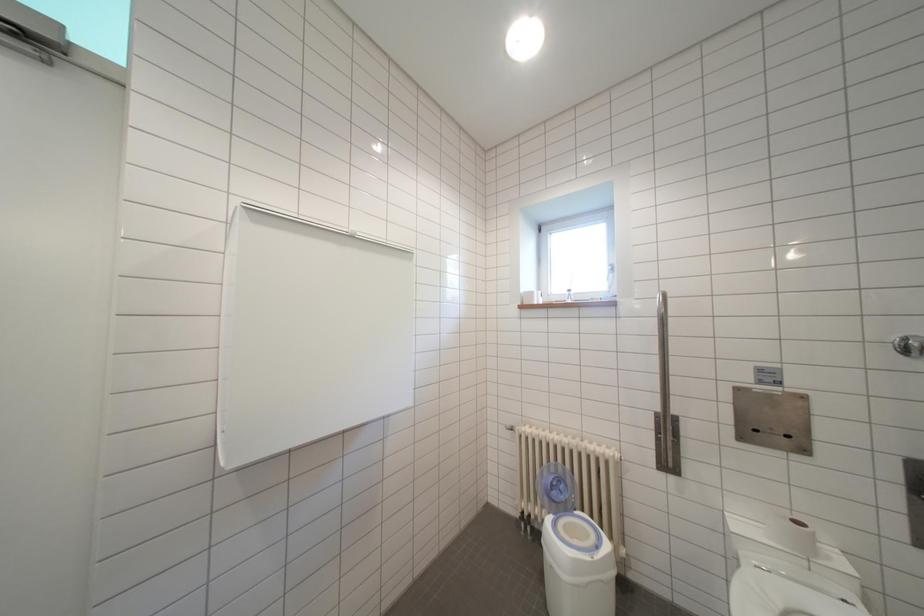
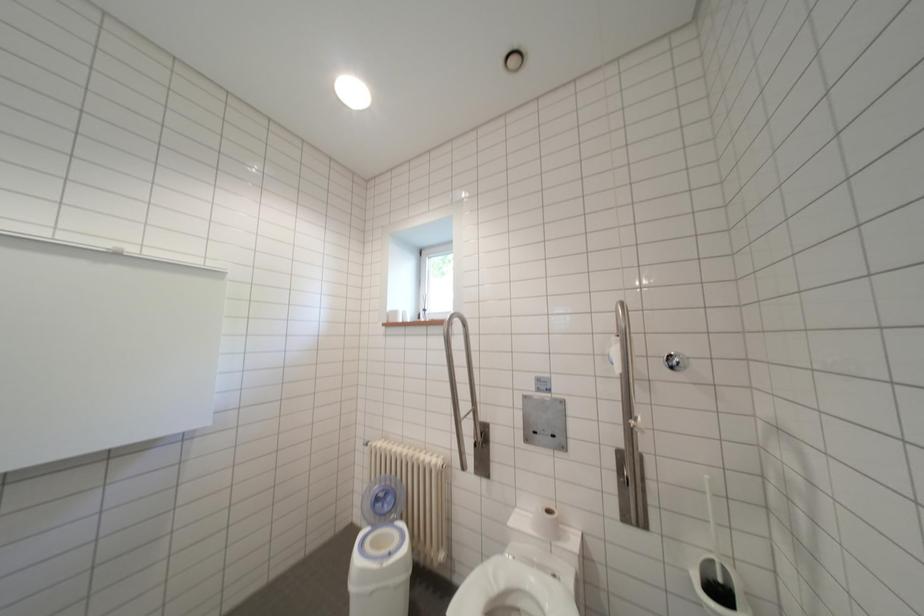
Question: The images are taken continuously from a first-person perspective. In which direction is your viewpoint rotating?

Choices:
 (A) Left
 (B) Right
 (C) Up
 (D) Down

Answer: (B)